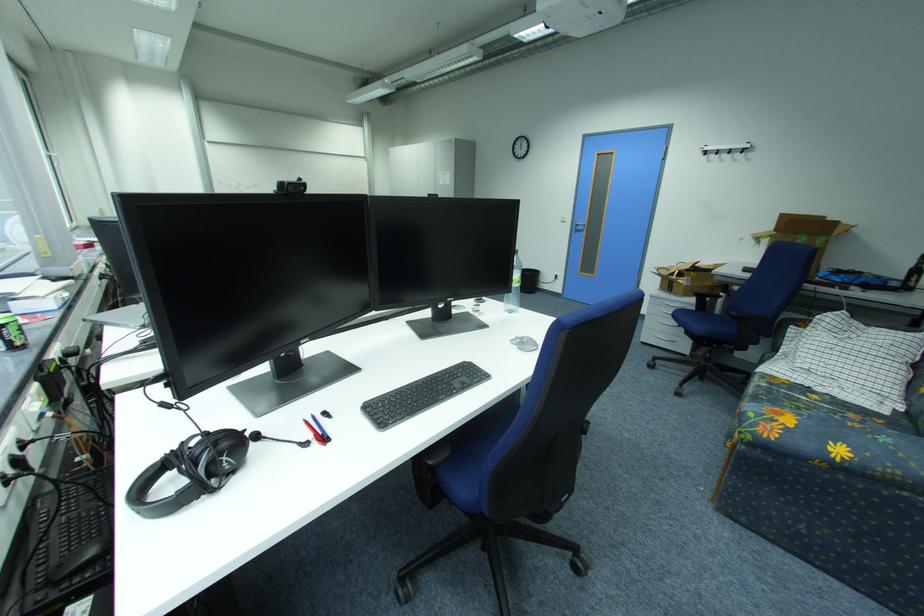
Where is `silver computer mouse`? silver computer mouse is located at coordinates (524, 342).